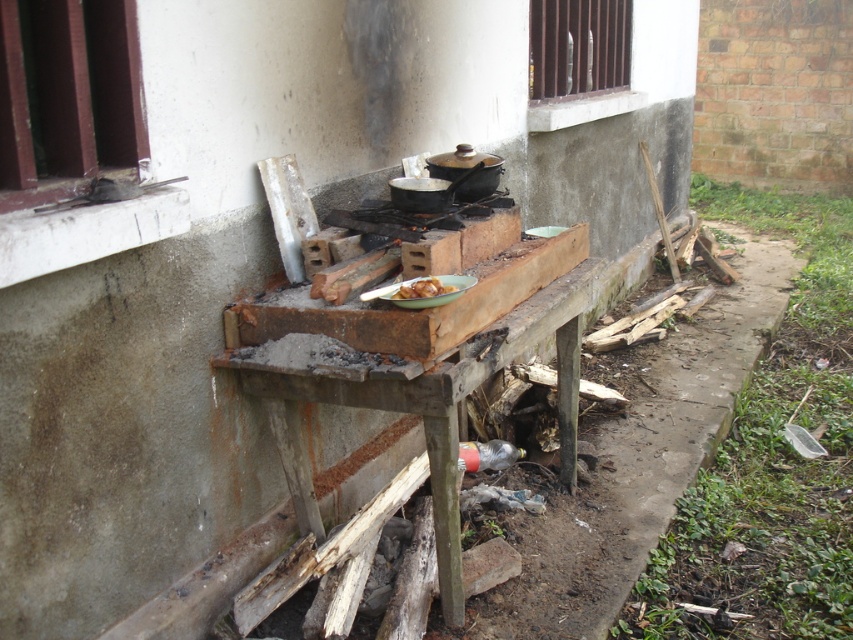
Question: Is rusty wooden table at center bigger than yellow matte plate at center?

Choices:
 (A) no
 (B) yes

Answer: (B)

Question: Among these objects, which one is nearest to the camera?

Choices:
 (A) rusty wooden table at center
 (B) yellow matte plate at center

Answer: (B)

Question: From the image, what is the correct spatial relationship of rusty wooden table at center in relation to yellow matte plate at center?

Choices:
 (A) left
 (B) right

Answer: (B)

Question: Is rusty wooden table at center positioned before yellow matte plate at center?

Choices:
 (A) no
 (B) yes

Answer: (A)